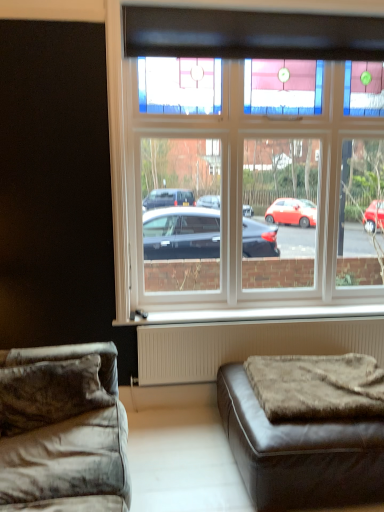
Question: Is point coord(225,309) closer or farther from the camera than point coord(107,500)?

Choices:
 (A) closer
 (B) farther

Answer: (B)

Question: Which is correct: white plastic window sill at lower center is inside velvet gray couch at lower left, the 2th studio couch when ordered from right to left, or outside of it?

Choices:
 (A) outside
 (B) inside

Answer: (A)

Question: Which is farther from the clear glass window at upper center?

Choices:
 (A) brown fuzzy mattress at lower right
 (B) velvet gray couch at lower left, which ranks as the first studio couch in left-to-right order
 (C) brown leather ottoman at lower right, positioned as the first studio couch in right-to-left order
 (D) white plastic window sill at lower center
 (E) white textured radiator at lower center

Answer: (C)

Question: Based on their relative distances, which object is nearer to the brown fuzzy mattress at lower right?

Choices:
 (A) white plastic window sill at lower center
 (B) clear glass window at upper center
 (C) velvet gray couch at lower left, which ranks as the first studio couch in left-to-right order
 (D) brown leather ottoman at lower right, the second studio couch from the left
 (E) white textured radiator at lower center

Answer: (D)